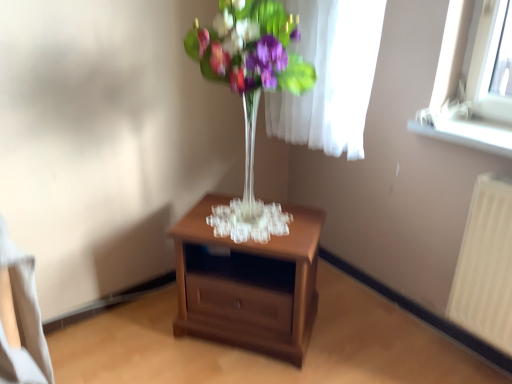
The width and height of the screenshot is (512, 384). I want to click on vacant space underneath clear glass vase at center (from a real-world perspective), so click(249, 226).